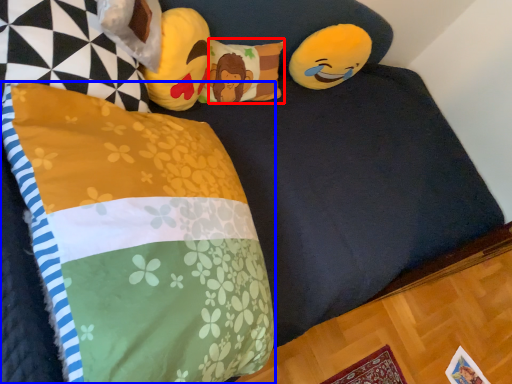
Question: Among these objects, which one is farthest to the camera, pillow (highlighted by a red box) or pillow (highlighted by a blue box)?

Choices:
 (A) pillow
 (B) pillow

Answer: (A)